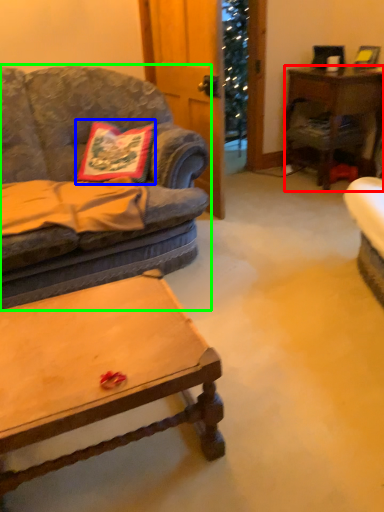
Question: Which object is positioned farthest from desk (highlighted by a red box)? Select from pillow (highlighted by a blue box) and studio couch (highlighted by a green box).

Choices:
 (A) pillow
 (B) studio couch

Answer: (A)